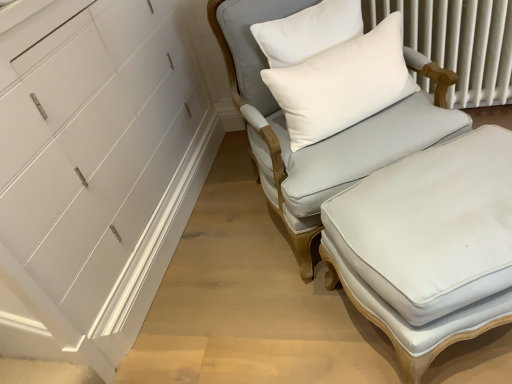
What is the approximate width of white soft cushion at upper right?

white soft cushion at upper right is 7.38 inches wide.

At what (x,y) coordinates should I click in order to perform the action: click on white soft cushion at upper right. Please return your answer as a coordinate pair (x, y). This screenshot has width=512, height=384. Looking at the image, I should click on (342, 84).

I want to click on white fabric ottoman at center, so click(x=428, y=245).

Is point (487, 280) closer to camera compared to point (426, 24)?

Yes, point (487, 280) is in front of point (426, 24).

From the image's perspective, is white fabric ottoman at center under white textured radiator at upper right?

Yes.

How different are the orientations of white fabric ottoman at center and white textured radiator at upper right in degrees?

There is a 31.1-degree angle between the facing directions of white fabric ottoman at center and white textured radiator at upper right.

Which of these two, light gray fabric chair at center or white soft cushion at upper right, stands shorter?

Standing shorter between the two is white soft cushion at upper right.

Is light gray fabric chair at center turned away from white soft cushion at upper right?

Correct, light gray fabric chair at center is looking away from white soft cushion at upper right.

Looking at this image, considering the relative sizes of light gray fabric chair at center and white soft cushion at upper right in the image provided, is light gray fabric chair at center thinner than white soft cushion at upper right?

No.

From a real-world perspective, is light gray fabric chair at center above or below white soft cushion at upper right?

From a real-world perspective, light gray fabric chair at center is physically below white soft cushion at upper right.

Looking at this image, is white soft cushion at upper right taller or shorter than white textured radiator at upper right?

In the image, white soft cushion at upper right appears to be shorter than white textured radiator at upper right.

Which of these two, white soft cushion at upper right or white textured radiator at upper right, is bigger?

white textured radiator at upper right.

Does white soft cushion at upper right turn towards white textured radiator at upper right?

No, white soft cushion at upper right is not turned towards white textured radiator at upper right.

Would you say white soft cushion at upper right is outside white textured radiator at upper right?

Yes, white soft cushion at upper right is located beyond the bounds of white textured radiator at upper right.

Who is bigger, white fabric ottoman at center or white soft cushion at upper right?

With larger size is white fabric ottoman at center.

From the image's perspective, is white fabric ottoman at center on top of white soft cushion at upper right?

No, from the image's perspective, white fabric ottoman at center is not above white soft cushion at upper right.

Which object is more forward, white fabric ottoman at center or white soft cushion at upper right?

white fabric ottoman at center.

From a real-world perspective, does white textured radiator at upper right stand above light gray fabric chair at center?

No, from a real-world perspective, white textured radiator at upper right is not over light gray fabric chair at center

Where is `chair located in front of the white textured radiator at upper right`? The height and width of the screenshot is (384, 512). chair located in front of the white textured radiator at upper right is located at coordinates (328, 138).

Considering their positions, is white textured radiator at upper right located in front of or behind light gray fabric chair at center?

Visually, white textured radiator at upper right is located behind light gray fabric chair at center.

Identify the location of table directly beneath the light gray fabric chair at center (from a real-world perspective). This screenshot has width=512, height=384. (428, 245).

Considering the sizes of objects light gray fabric chair at center and white fabric ottoman at center in the image provided, who is smaller, light gray fabric chair at center or white fabric ottoman at center?

Smaller between the two is white fabric ottoman at center.

In the image, is light gray fabric chair at center positioned in front of or behind white fabric ottoman at center?

Clearly, light gray fabric chair at center is behind white fabric ottoman at center.

Is point (319, 193) less distant than point (451, 288)?

No.

Is white fabric ottoman at center positioned far away from light gray fabric chair at center?

That's not correct — white fabric ottoman at center is a little close to light gray fabric chair at center.

Which is more to the right, white fabric ottoman at center or light gray fabric chair at center?

white fabric ottoman at center is more to the right.

From a real-world perspective, is white fabric ottoman at center located higher than light gray fabric chair at center?

Actually, white fabric ottoman at center is physically below light gray fabric chair at center in the real world.

Does white fabric ottoman at center turn towards light gray fabric chair at center?

No, white fabric ottoman at center is not oriented towards light gray fabric chair at center.

Identify the location of table located underneath the white textured radiator at upper right (from a real-world perspective). The height and width of the screenshot is (384, 512). (428, 245).

The image size is (512, 384). I want to click on chair to the left of white soft cushion at upper right, so click(x=328, y=138).

From the picture: Looking at the image, which one is located further to white textured radiator at upper right, light gray fabric chair at center or white fabric ottoman at center?

white fabric ottoman at center lies further to white textured radiator at upper right than the other object.

Looking at the image, which one is located closer to light gray fabric chair at center, white textured radiator at upper right or white fabric ottoman at center?

Among the two, white fabric ottoman at center is located nearer to light gray fabric chair at center.

In the scene shown: Estimate the real-world distances between objects in this image. Which object is closer to white textured radiator at upper right, white fabric ottoman at center or light gray fabric chair at center?

light gray fabric chair at center.

Which object lies nearer to the anchor point white textured radiator at upper right, white soft cushion at upper right or light gray fabric chair at center?

white soft cushion at upper right is positioned closer to the anchor white textured radiator at upper right.

From the image, which object appears to be nearer to white textured radiator at upper right, white soft cushion at upper right or white fabric ottoman at center?

white soft cushion at upper right is positioned closer to the anchor white textured radiator at upper right.

In the scene shown: Considering their positions, is white soft cushion at upper right positioned closer to light gray fabric chair at center than white textured radiator at upper right?

white soft cushion at upper right.

Based on their spatial positions, is white fabric ottoman at center or white textured radiator at upper right closer to white soft cushion at upper right?

white fabric ottoman at center is closer to white soft cushion at upper right.

From the image, which object appears to be nearer to white fabric ottoman at center, white textured radiator at upper right or light gray fabric chair at center?

light gray fabric chair at center is positioned closer to the anchor white fabric ottoman at center.

Image resolution: width=512 pixels, height=384 pixels. I want to click on chair that lies between white textured radiator at upper right and white fabric ottoman at center from top to bottom, so click(x=328, y=138).

This screenshot has height=384, width=512. What are the coordinates of `pillow between white textured radiator at upper right and white fabric ottoman at center from top to bottom` in the screenshot? It's located at (342, 84).

Where is `pillow located between light gray fabric chair at center and white textured radiator at upper right in the left-right direction`? pillow located between light gray fabric chair at center and white textured radiator at upper right in the left-right direction is located at coordinates [x=342, y=84].

At what (x,y) coordinates should I click in order to perform the action: click on chair between white soft cushion at upper right and white fabric ottoman at center in the up-down direction. Please return your answer as a coordinate pair (x, y). This screenshot has width=512, height=384. Looking at the image, I should click on (x=328, y=138).